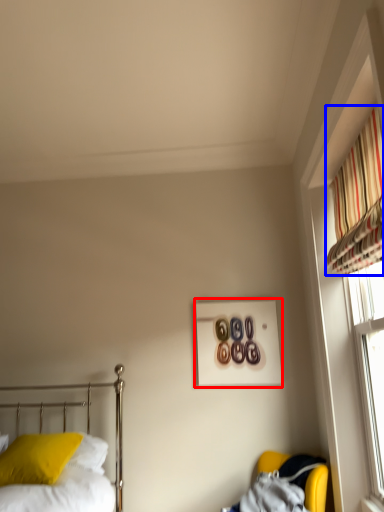
Question: Among these objects, which one is nearest to the camera, picture frame (highlighted by a red box) or curtain (highlighted by a blue box)?

Choices:
 (A) picture frame
 (B) curtain

Answer: (B)